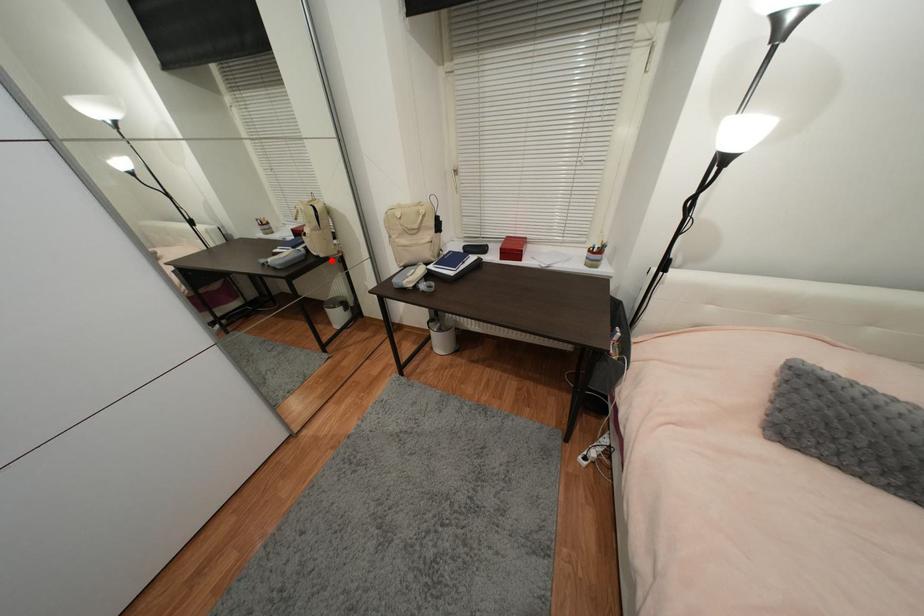
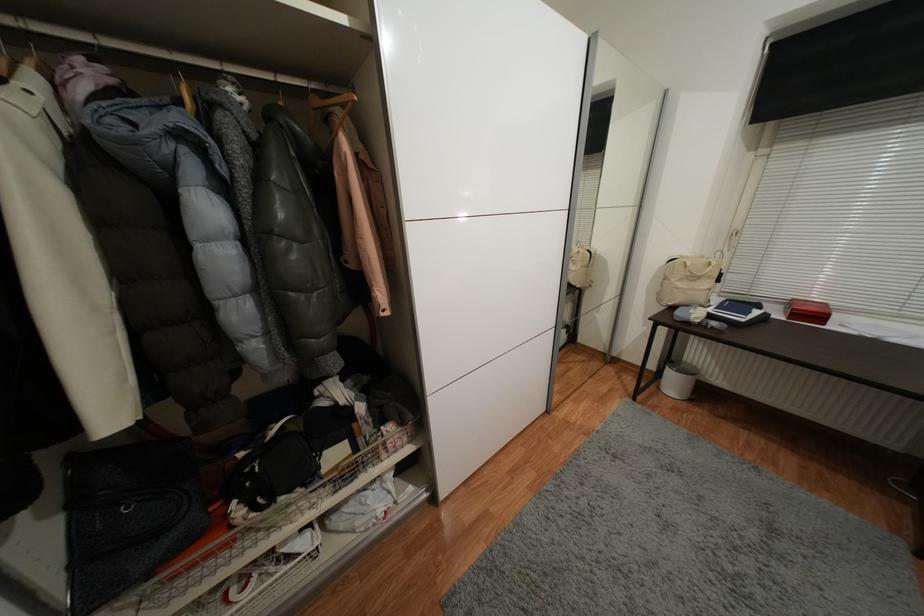
Question: A red point is marked in image1. In image2, is the corresponding 3D point closer to the camera or farther? Reply with the corresponding letter.

Choices:
 (A) The corresponding 3D point is closer.
 (B) The corresponding 3D point is farther.

Answer: (B)